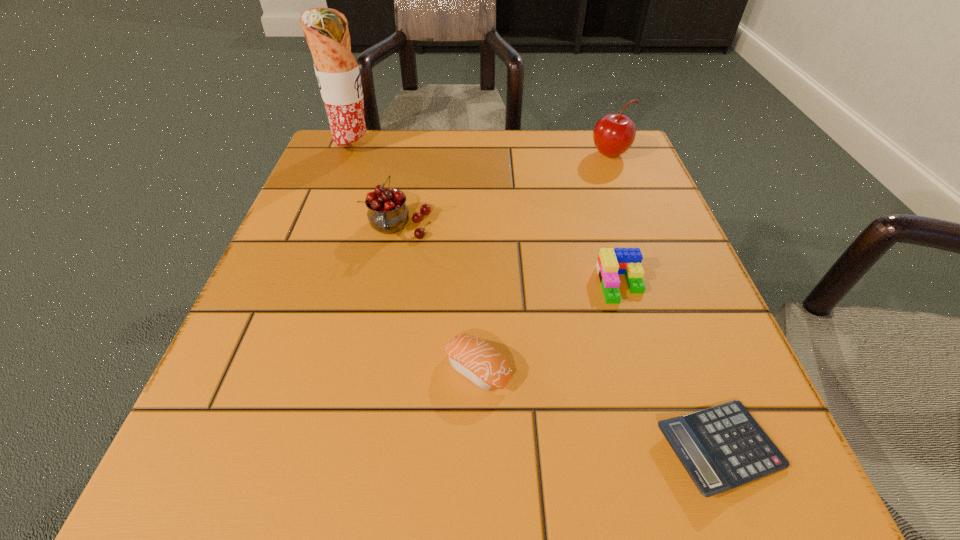
In the image, there is a desktop. At what (x,y) coordinates should I click in order to perform the action: click on free space at the near left corner. Please return your answer as a coordinate pair (x, y). This screenshot has width=960, height=540. Looking at the image, I should click on (244, 490).

Where is `vacant space that's between the Lego and the burrito`? This screenshot has width=960, height=540. vacant space that's between the Lego and the burrito is located at coordinates (488, 216).

This screenshot has height=540, width=960. In order to click on free space between the right cherry and the sushi in this screenshot , I will do click(x=544, y=261).

You are a GUI agent. You are given a task and a screenshot of the screen. Output one action in this format:
    pyautogui.click(x=<x>, y=<y>)
    Task: Click on the empty space that is in between the leftmost object and the sushi
    Image resolution: width=960 pixels, height=540 pixels.
    Given the screenshot: What is the action you would take?
    pyautogui.click(x=416, y=258)

Identify the location of empty location between the fourth farthest object and the second nearest object. (549, 326).

Locate an element on the screen. Image resolution: width=960 pixels, height=540 pixels. vacant region between the farther cherry and the left cherry is located at coordinates (505, 191).

Identify the location of free space between the calculator and the farther cherry. The height and width of the screenshot is (540, 960). (664, 301).

Where is `empty space between the shortest object and the right cherry`? The height and width of the screenshot is (540, 960). empty space between the shortest object and the right cherry is located at coordinates (664, 301).

At what (x,y) coordinates should I click in order to perform the action: click on vacant space that's between the right cherry and the burrito. Please return your answer as a coordinate pair (x, y). This screenshot has width=960, height=540. Looking at the image, I should click on (482, 151).

Identify which object is the third closest to the burrito. Please provide its 2D coordinates. Your answer should be formatted as a tuple, i.e. [(x, y)], where the tuple contains the x and y coordinates of a point satisfying the conditions above.

[(476, 360)]